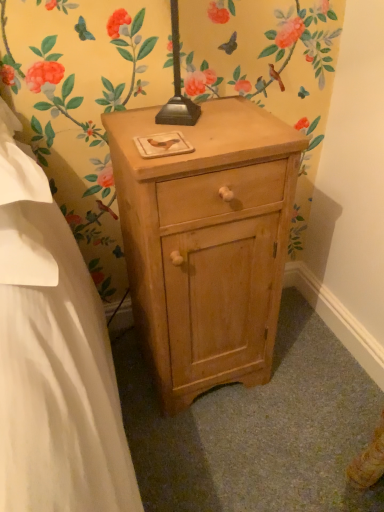
What do you see at coordinates (206, 242) in the screenshot?
I see `natural wood nightstand at center` at bounding box center [206, 242].

Identify the location of natural wood nightstand at center. (206, 242).

This screenshot has width=384, height=512. In order to click on natural wood nightstand at center in this screenshot , I will do `click(206, 242)`.